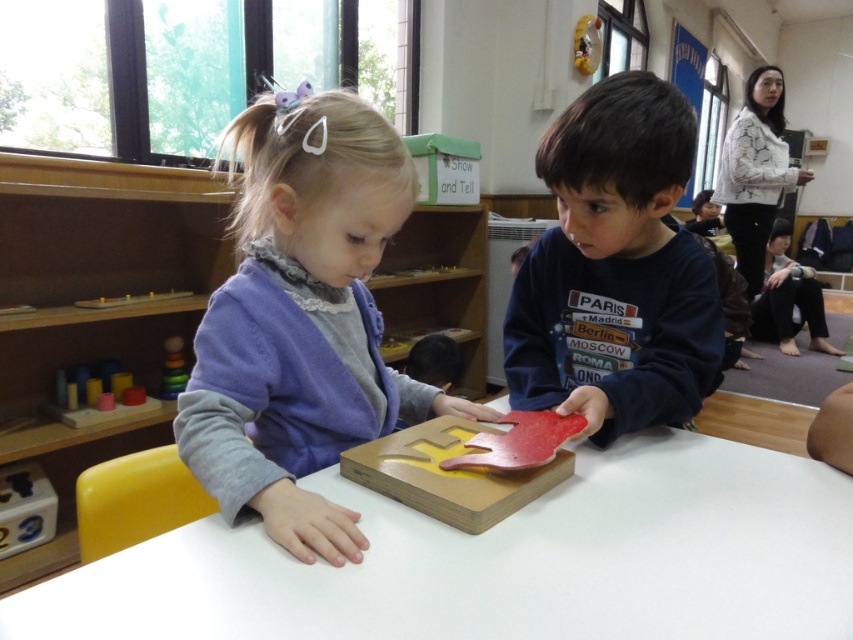
Who is positioned more to the right, purple matte sweater at upper left or wooden block at lower left?

purple matte sweater at upper left is more to the right.

Which is in front, point (241, 404) or point (6, 544)?

Point (241, 404) is more forward.

The image size is (853, 640). In order to click on purple matte sweater at upper left in this screenshot , I will do `click(302, 321)`.

Can you confirm if white matte table at center is positioned above purple matte sweater at upper left?

No, white matte table at center is not above purple matte sweater at upper left.

Does white matte table at center have a smaller size compared to purple matte sweater at upper left?

Yes, white matte table at center is smaller than purple matte sweater at upper left.

Does point (659, 628) come farther from viewer compared to point (244, 378)?

No, it is in front of (244, 378).

The image size is (853, 640). Find the location of `white matte table at center`. white matte table at center is located at coordinates (506, 561).

Does point (657, 429) come behind point (178, 388)?

That is False.

Based on the photo, can you confirm if white matte table at center is shorter than smooth plastic stacking rings at left?

Correct, white matte table at center is not as tall as smooth plastic stacking rings at left.

At what (x,y) coordinates should I click in order to perform the action: click on white matte table at center. Please return your answer as a coordinate pair (x, y). The height and width of the screenshot is (640, 853). Looking at the image, I should click on (506, 561).